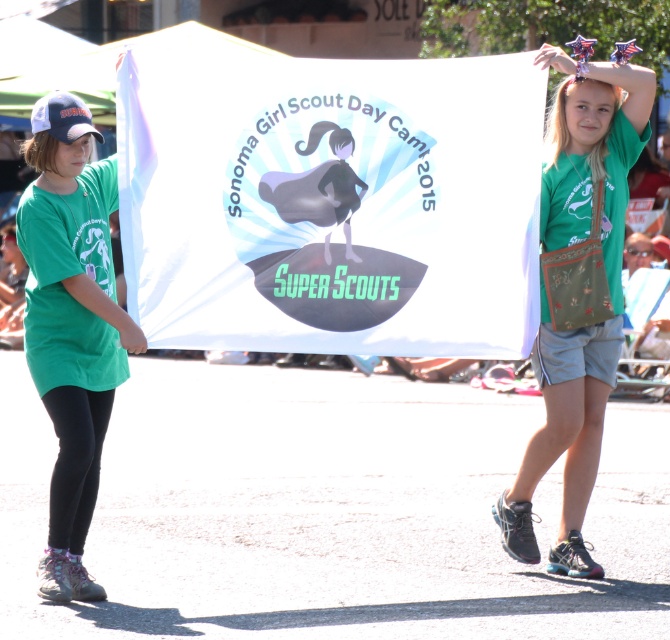
You are standing in front of the banner held by the two girls at the Sonoma Girl Scout Day Camp 2015 event. You notice two points marked on the banner. The first point is at coordinates point (90, 452) and the second is at point (604, 218). Which of these points is closer to your viewpoint?

The point at (90, 452) is closer to your viewpoint because it is closer to the camera than the point at (604, 218).

You are a photographer at the event and want to ensure both the green fabric shirt at left and the green fabric purse at center are clearly visible in your photo. Given their sizes, which object should you focus on first to ensure it doesn

The green fabric shirt at left has a lesser height compared to the green fabric purse at center, so you should focus on the green fabric purse at center first since it is larger and more prominent in the image.

You are at a community event and see two items displayed in the scene. One is the green fabric shirt at left and the other is the green fabric purse at center. Which item is located to the right of the other?

The green fabric purse at center is located to the right of the green fabric shirt at left.